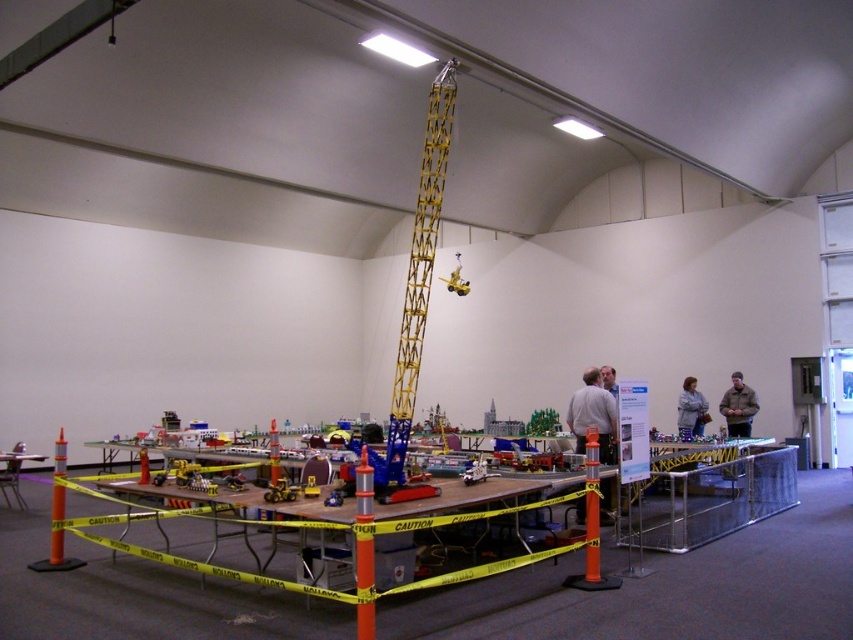
Question: Which object appears closest to the camera in this image?

Choices:
 (A) light gray fabric jacket at center right
 (B) orange reflective cone at center
 (C) brown fuzzy jacket at lower right
 (D) yellow metallic crane at center

Answer: (B)

Question: In this image, where is yellow metallic crane at center located relative to light gray shirt at center?

Choices:
 (A) left
 (B) right

Answer: (A)

Question: Which of the following is the farthest from the observer?

Choices:
 (A) orange reflective cone at center
 (B) yellow metallic crane at center
 (C) light gray shirt at center
 (D) brown fuzzy jacket at lower right

Answer: (D)

Question: Estimate the real-world distances between objects in this image. Which object is closer to the light gray shirt at center?

Choices:
 (A) yellow metallic crane at center
 (B) light gray fabric jacket at center right
 (C) orange reflective cone at center

Answer: (A)

Question: Can you confirm if brown fuzzy jacket at lower right is wider than light gray fabric jacket at center right?

Choices:
 (A) no
 (B) yes

Answer: (A)

Question: Does yellow metallic crane at center come behind brown fuzzy jacket at lower right?

Choices:
 (A) no
 (B) yes

Answer: (A)